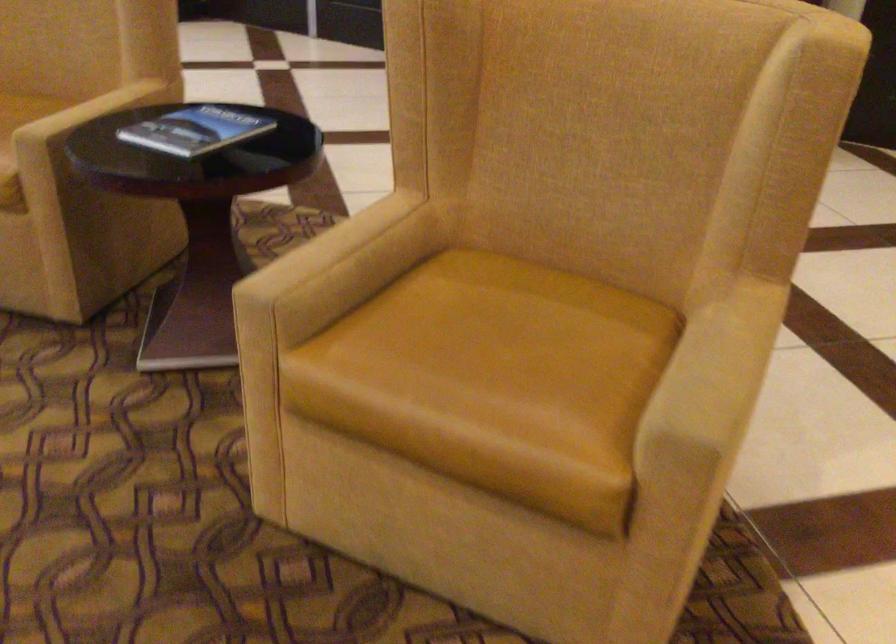
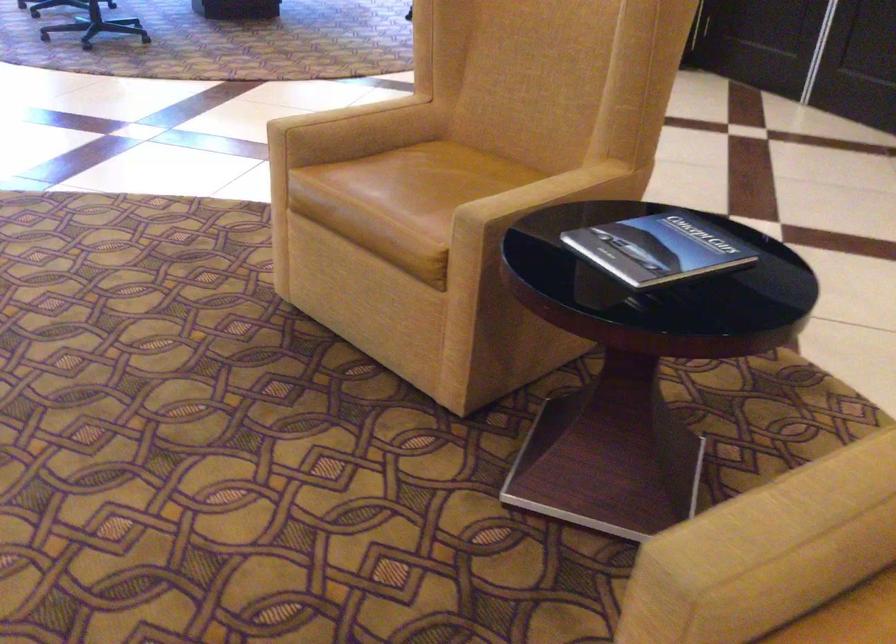
The point at (202,125) is marked in the first image. Where is the corresponding point in the second image?

(657, 249)